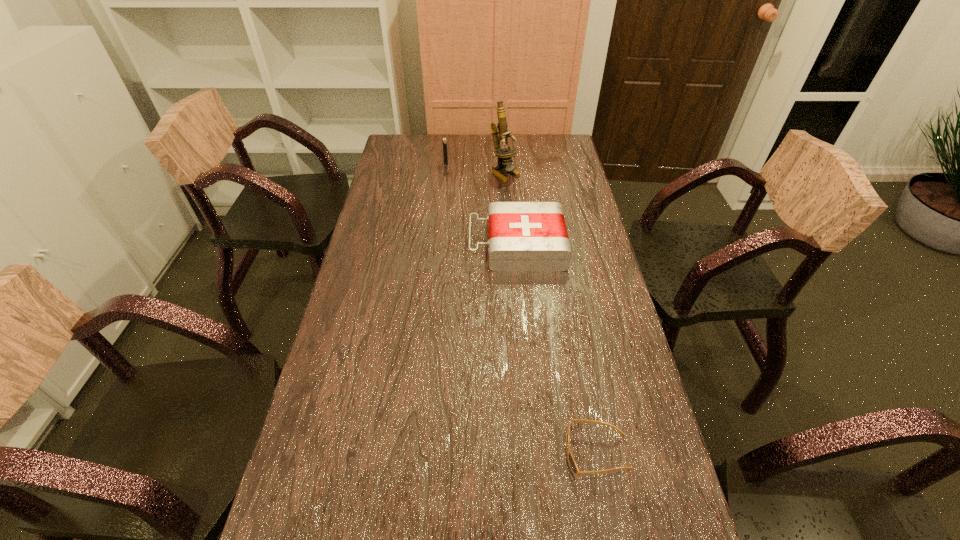
Find the location of a particular element. The height and width of the screenshot is (540, 960). microscope is located at coordinates (499, 132).

Find the location of `igniter`. igniter is located at coordinates (444, 140).

Identify the location of the third shortest object. (444, 140).

Image resolution: width=960 pixels, height=540 pixels. I want to click on the second shortest object, so click(x=523, y=236).

Locate an element on the screen. The height and width of the screenshot is (540, 960). the second nearest object is located at coordinates point(523,236).

Where is `the shortest object`? the shortest object is located at coordinates (572, 463).

Image resolution: width=960 pixels, height=540 pixels. I want to click on the nearest object, so click(x=572, y=463).

Identify the location of free space located on the left of the tallest object. The width and height of the screenshot is (960, 540). (475, 174).

The height and width of the screenshot is (540, 960). In order to click on vacant space situated on the back of the second tallest object in this screenshot , I will do `click(447, 146)`.

Locate an element on the screen. The image size is (960, 540). free space located on the front side of the second nearest object is located at coordinates (396, 245).